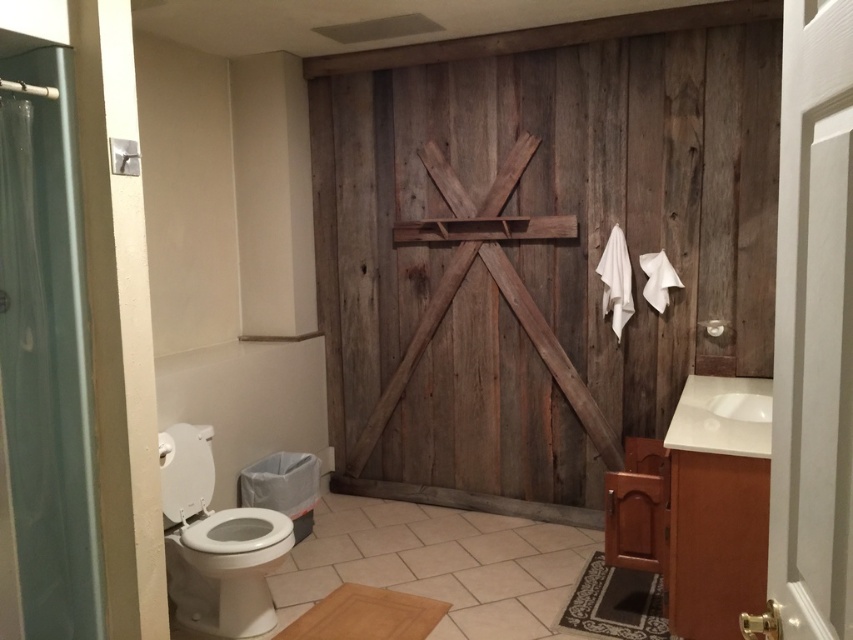
You are standing in the bathroom and want to open the weathered wood barn door at center. Considering your height is 5 feet 6 inches, is the door within your reach?

The distance between you and the weathered wood barn door at center is 9.74 feet. Since this distance is greater than your height of 5.5 feet, you can comfortably reach the door to open it.

You are planning to replace the white glossy toilet bowl at lower left and the white glossy sink at right with new ones. The new toilet requires a space of 0.8 meters in width, while the new sink needs 1.2 meters. Based on their current sizes, will both fit in their respective locations?

The white glossy toilet bowl at lower left is smaller than the white glossy sink at right. Since the new toilet requires 0.8 meters and the sink needs 1.2 meters, it depends on the available space. However, since the current toilet is smaller, the new one might fit if the space allows. The sink replacement would need to ensure the 1.2 meters fits in its area. Without exact measurements, we can only assume based on size comparison.